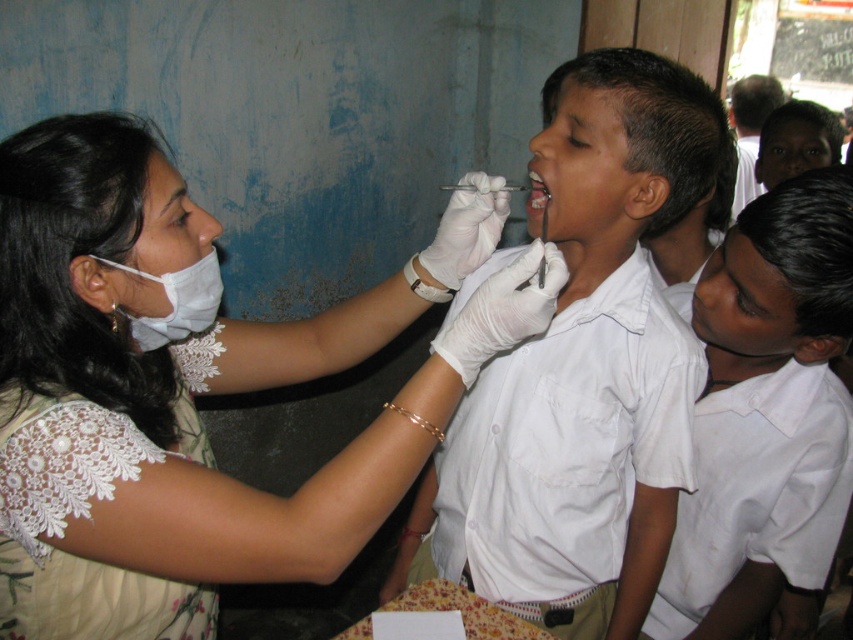
Question: Which of the following is the closest to the observer?

Choices:
 (A) (741, 500)
 (B) (173, 292)
 (C) (662, 122)
 (D) (206, 324)

Answer: (B)

Question: Which point is closer to the camera?

Choices:
 (A) (572, 96)
 (B) (750, 566)
 (C) (4, 192)
 (D) (206, 257)

Answer: (C)

Question: Can you confirm if white cotton shirt at center is wider than white fabric mask at upper left?

Choices:
 (A) yes
 (B) no

Answer: (A)

Question: Observing the image, what is the correct spatial positioning of white uniform shirt at center in reference to white fabric mask at upper left?

Choices:
 (A) left
 (B) right

Answer: (B)

Question: Which object appears closest to the camera in this image?

Choices:
 (A) white fabric mask at upper left
 (B) white uniform shirt at center

Answer: (A)

Question: Is white lace dress at center closer to camera compared to white fabric mask at upper left?

Choices:
 (A) no
 (B) yes

Answer: (B)